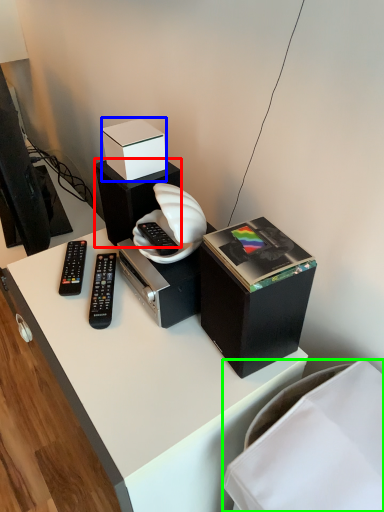
Question: Estimate the real-world distances between objects in this image. Which object is closer to speaker (highlighted by a red box), box (highlighted by a blue box) or furniture (highlighted by a green box)?

Choices:
 (A) box
 (B) furniture

Answer: (A)